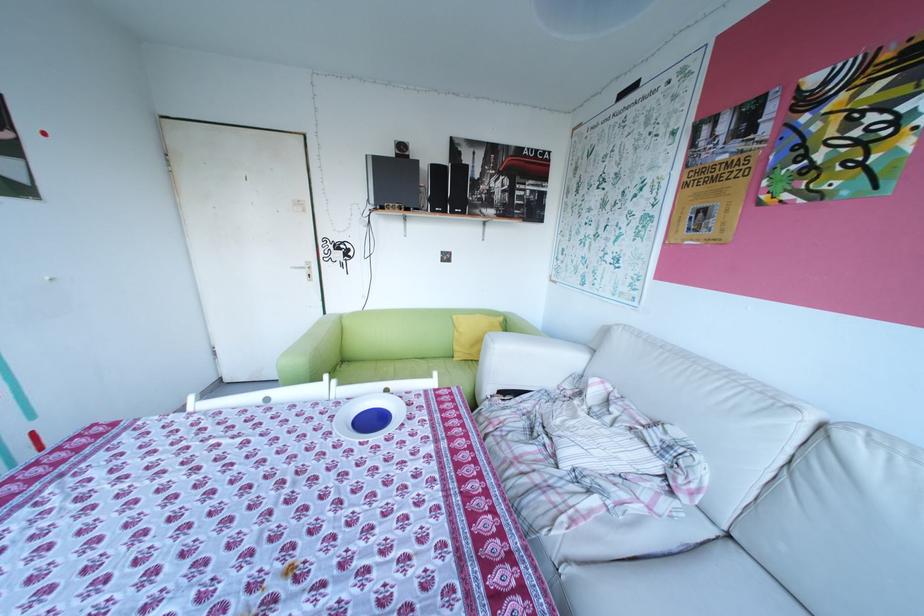
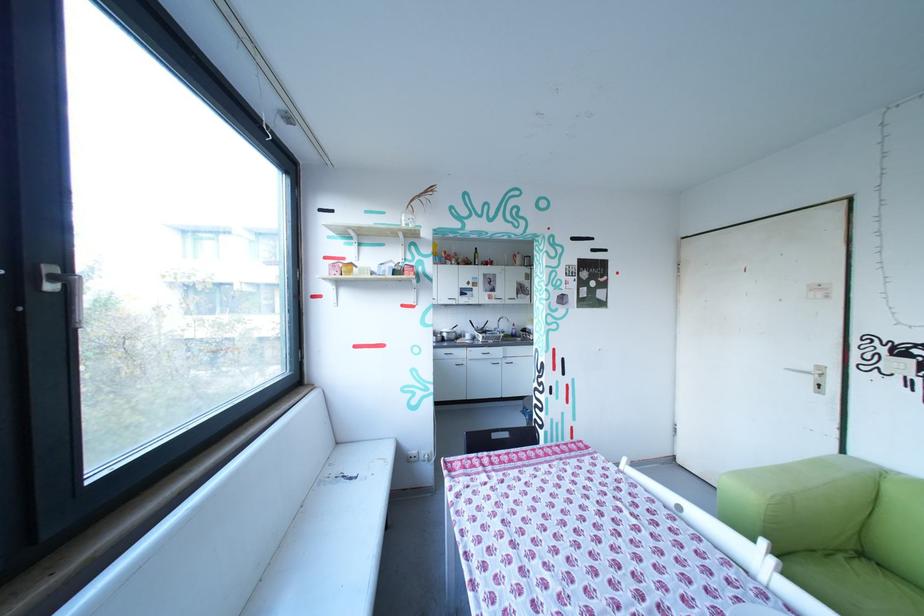
Find the pixel in the second image that matches (317,273) in the first image.

(821, 379)